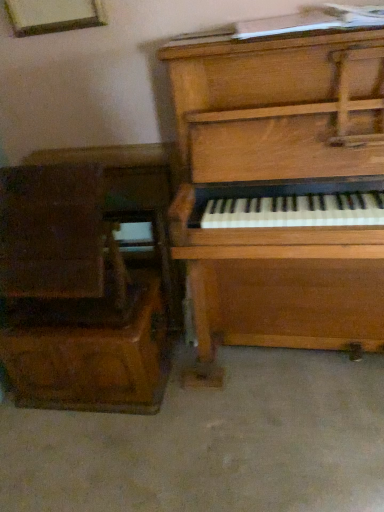
Question: From a real-world perspective, is wooden drawer at left on smooth concrete floor at lower center?

Choices:
 (A) no
 (B) yes

Answer: (B)

Question: Is wooden drawer at left not within smooth concrete floor at lower center?

Choices:
 (A) no
 (B) yes

Answer: (B)

Question: From a real-world perspective, is wooden drawer at left physically below smooth concrete floor at lower center?

Choices:
 (A) no
 (B) yes

Answer: (A)

Question: From the image's perspective, is wooden drawer at left located beneath smooth concrete floor at lower center?

Choices:
 (A) yes
 (B) no

Answer: (B)

Question: Can you confirm if wooden drawer at left is positioned to the left of smooth concrete floor at lower center?

Choices:
 (A) yes
 (B) no

Answer: (A)

Question: Is the surface of wooden drawer at left in direct contact with smooth concrete floor at lower center?

Choices:
 (A) yes
 (B) no

Answer: (B)

Question: From a real-world perspective, is wooden piano at right on smooth concrete floor at lower center?

Choices:
 (A) yes
 (B) no

Answer: (A)

Question: Would you say smooth concrete floor at lower center is part of wooden piano at right's contents?

Choices:
 (A) no
 (B) yes

Answer: (A)

Question: Considering the relative positions of wooden piano at right and smooth concrete floor at lower center in the image provided, is wooden piano at right to the left of smooth concrete floor at lower center from the viewer's perspective?

Choices:
 (A) no
 (B) yes

Answer: (A)

Question: Is wooden piano at right oriented towards smooth concrete floor at lower center?

Choices:
 (A) yes
 (B) no

Answer: (B)

Question: Is smooth concrete floor at lower center at the back of wooden piano at right?

Choices:
 (A) no
 (B) yes

Answer: (A)

Question: Is wooden piano at right bigger than smooth concrete floor at lower center?

Choices:
 (A) yes
 (B) no

Answer: (A)

Question: Is wooden piano at right located within wooden drawer at left?

Choices:
 (A) no
 (B) yes

Answer: (A)